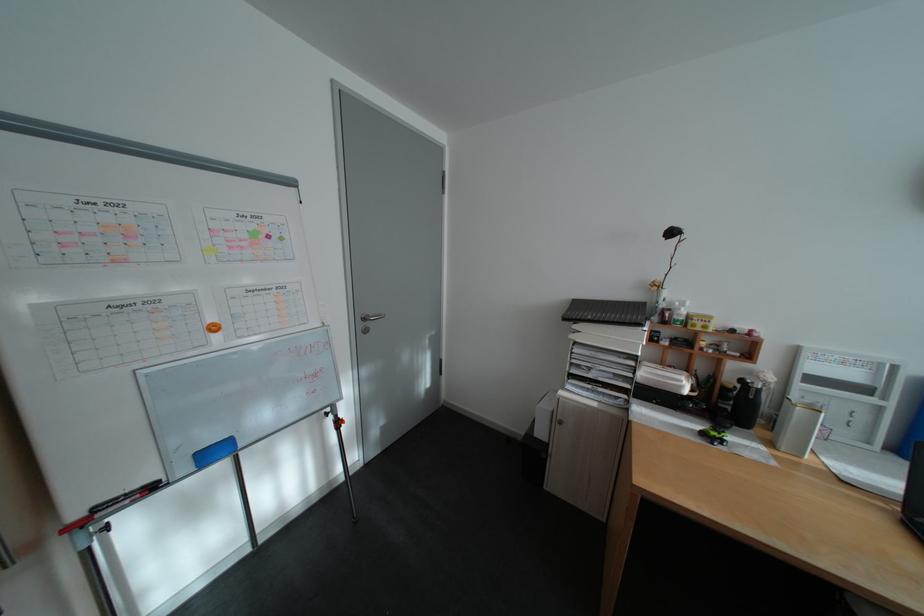
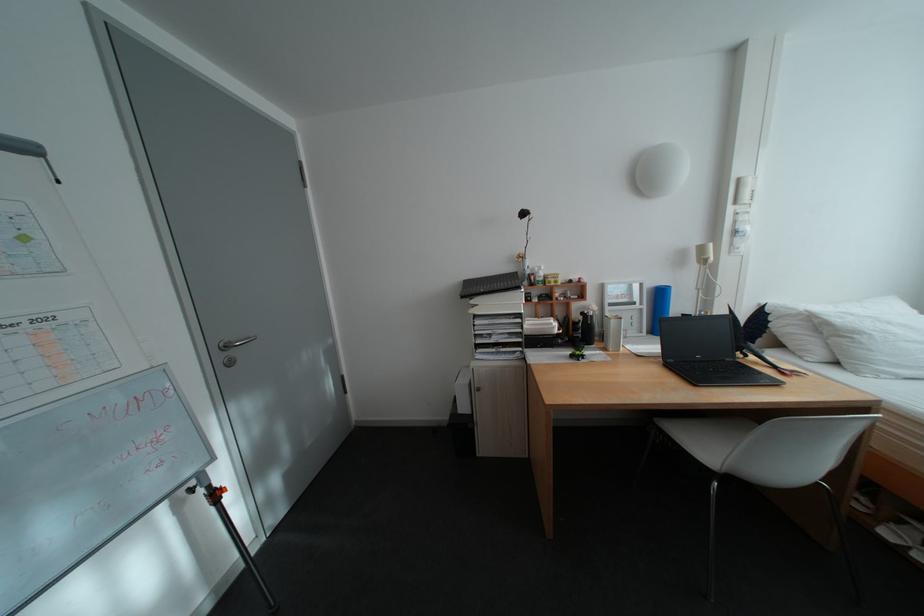
The point at (784, 446) is marked in the first image. Where is the corresponding point in the second image?

(617, 350)